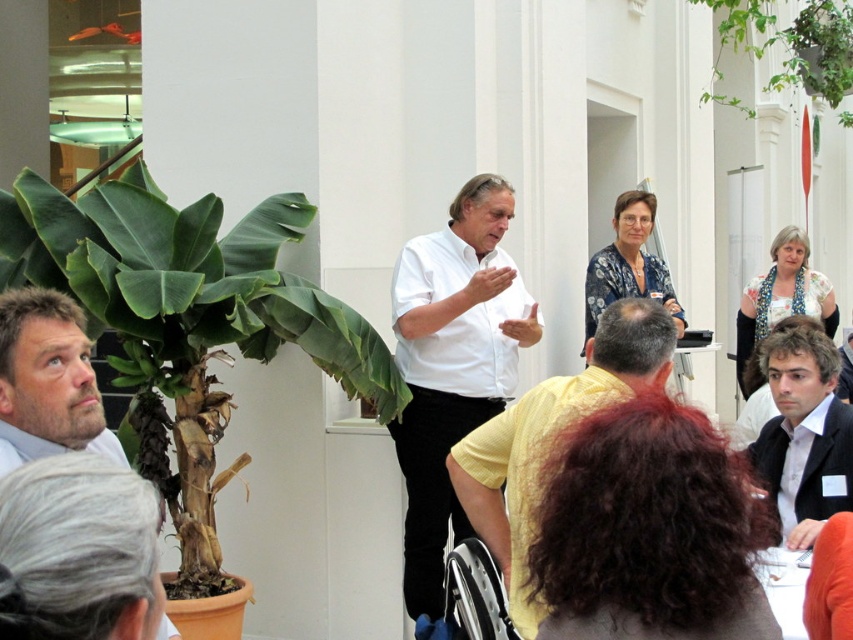
Can you confirm if dark blue suit at center is positioned below matte white shirt at lower left?

Yes, dark blue suit at center is below matte white shirt at lower left.

Who is taller, dark blue suit at center or matte white shirt at lower left?

dark blue suit at center is taller.

Who is more distant from viewer, (776, 420) or (82, 416)?

Positioned behind is point (776, 420).

Locate an element on the screen. dark blue suit at center is located at coordinates (804, 435).

Which of these two, light blue shirt at lower left or dark blue suit at center, stands taller?

Standing taller between the two is dark blue suit at center.

Who is more distant from viewer, (33, 417) or (807, 360)?

Point (807, 360)

Identify the location of light blue shirt at lower left. This screenshot has width=853, height=640. (47, 380).

Between green leafy plant at left and white matte shirt at center, which one is positioned lower?

white matte shirt at center

Can you confirm if green leafy plant at left is taller than white matte shirt at center?

In fact, green leafy plant at left may be shorter than white matte shirt at center.

Where is `green leafy plant at left`? The image size is (853, 640). green leafy plant at left is located at coordinates (186, 323).

Find the location of `green leafy plant at left`. green leafy plant at left is located at coordinates 186,323.